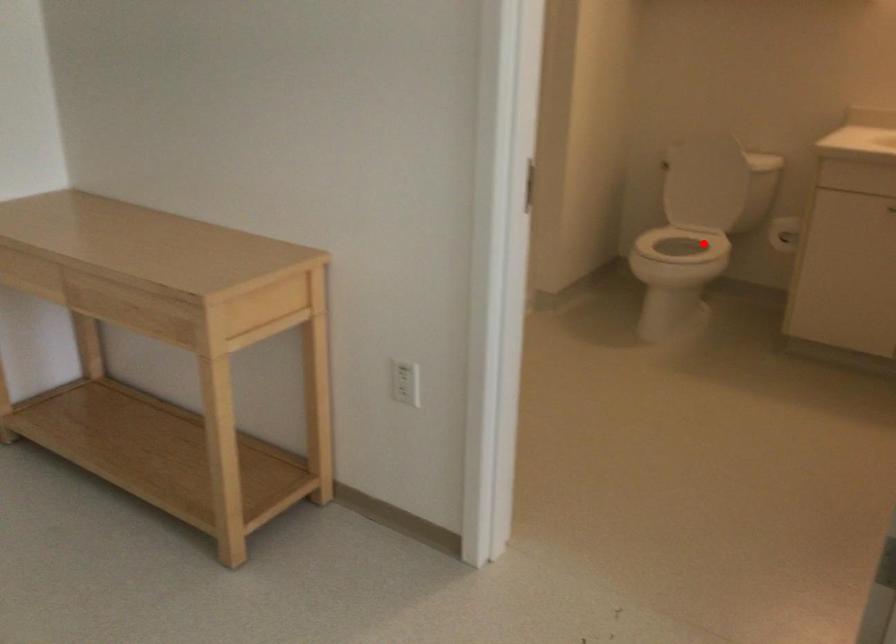
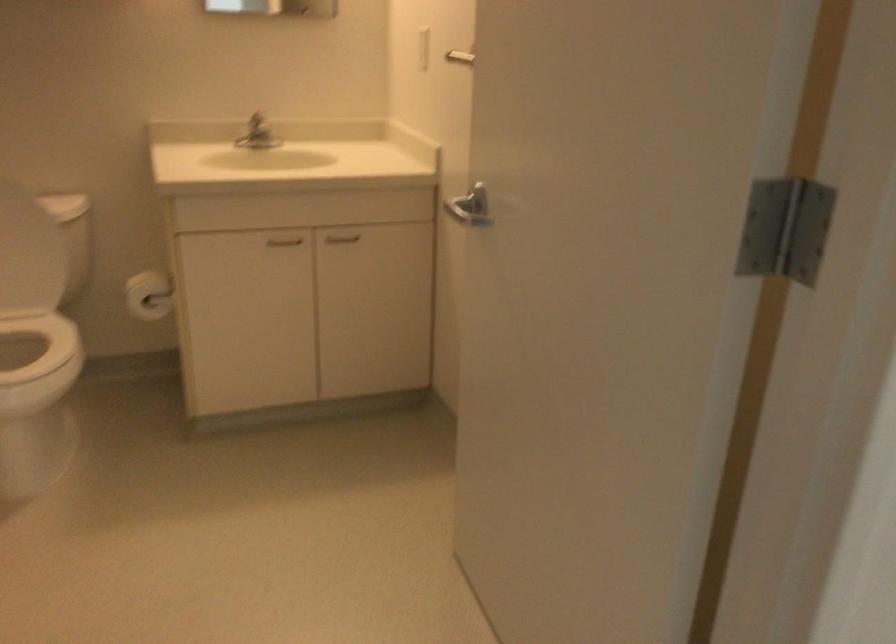
Locate, in the second image, the point that corresponds to the highlighted location in the first image.

(22, 341)